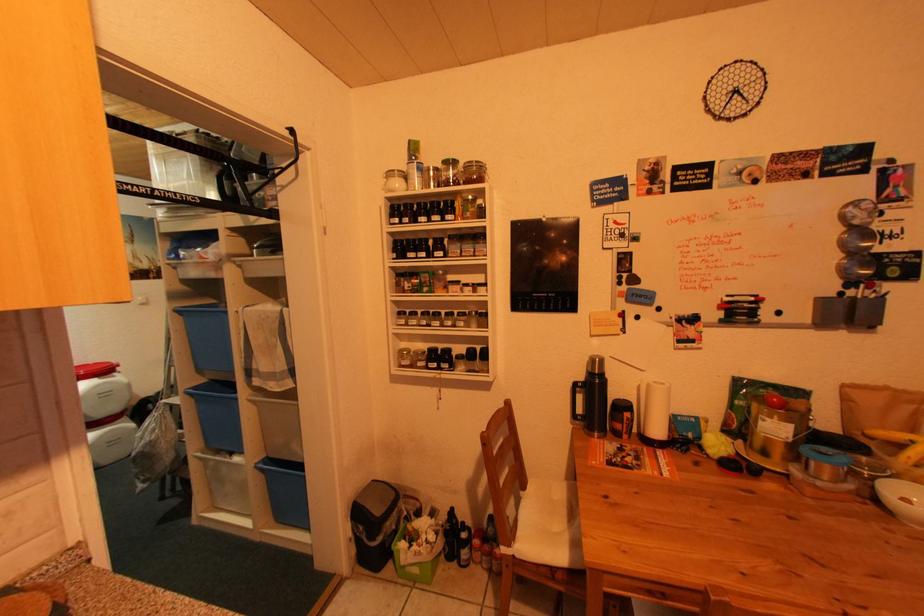
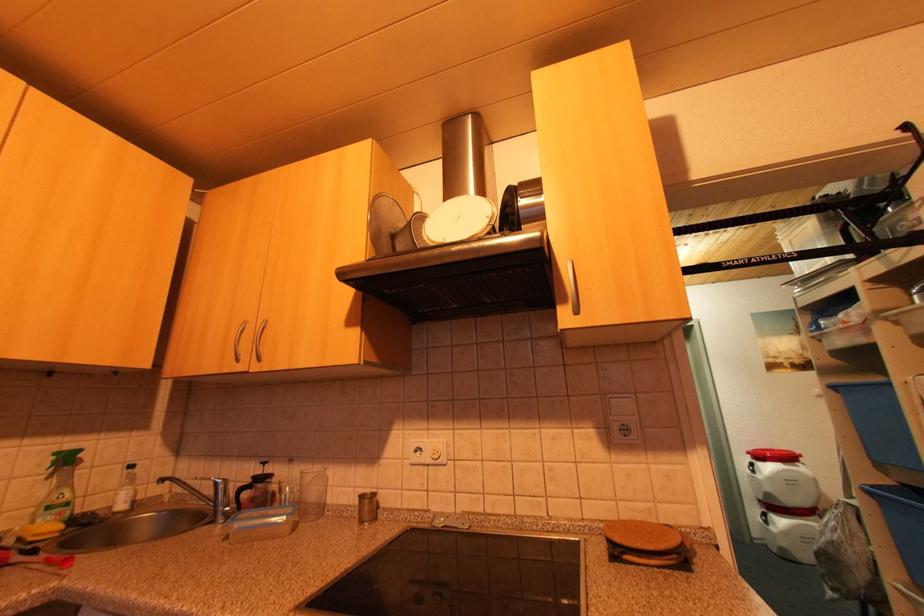
Question: The images are taken continuously from a first-person perspective. In which direction is your viewpoint rotating?

Choices:
 (A) Left
 (B) Right
 (C) Up
 (D) Down

Answer: (A)